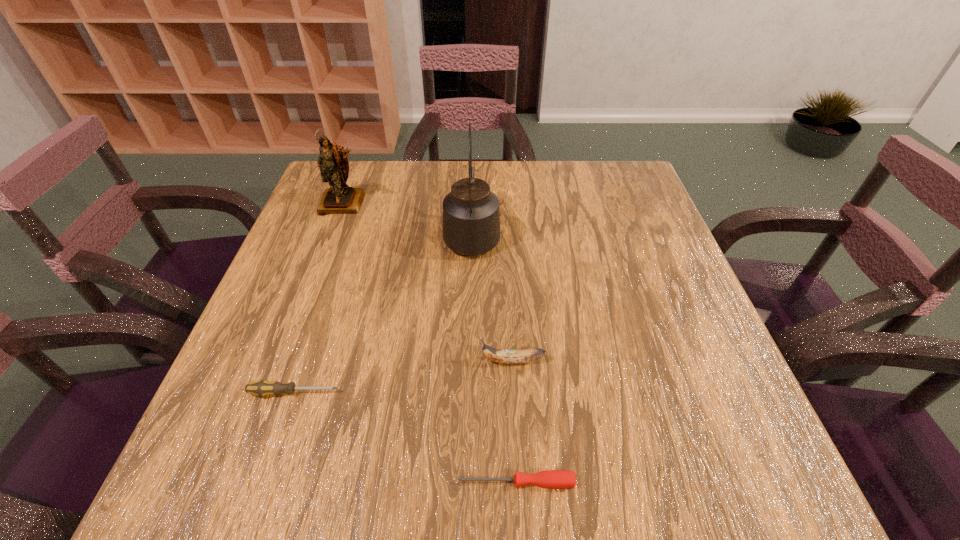
Image resolution: width=960 pixels, height=540 pixels. What are the coordinates of `the fourth closest object to the second shortest object` in the screenshot? It's located at (334, 167).